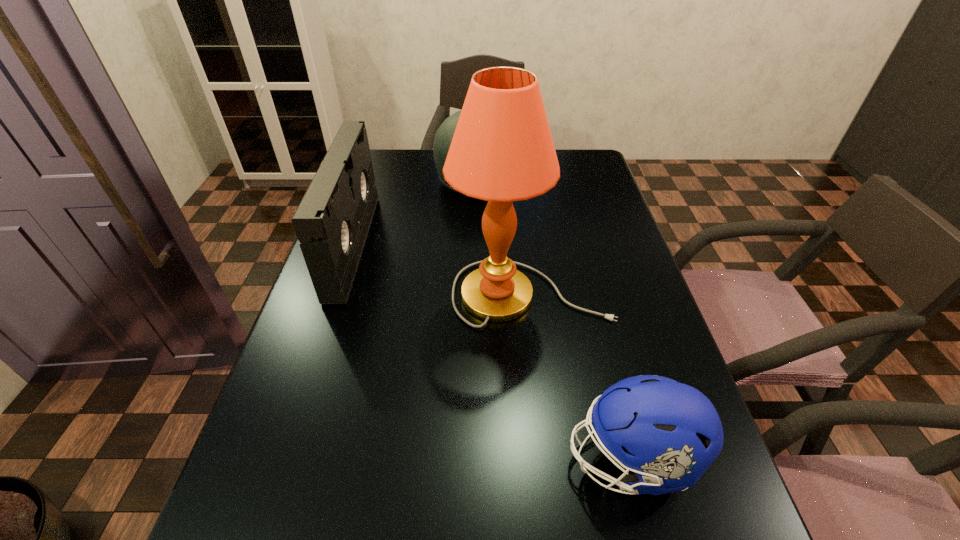
Identify the location of free space between the nearest object and the videotape. The height and width of the screenshot is (540, 960). (492, 352).

Locate an element on the screen. This screenshot has height=540, width=960. vacant point located between the leftmost object and the farther football helmet is located at coordinates [413, 214].

Find the location of a particular element. This screenshot has width=960, height=540. vacant space that's between the tallest object and the nearest object is located at coordinates (581, 376).

Locate an element on the screen. This screenshot has width=960, height=540. free space between the shortest object and the lamp is located at coordinates (581, 376).

At what (x,y) coordinates should I click in order to perform the action: click on empty space between the right football helmet and the taller football helmet. Please return your answer as a coordinate pair (x, y). Image resolution: width=960 pixels, height=540 pixels. Looking at the image, I should click on (552, 321).

Identify the location of unoccupied area between the taller football helmet and the nearest object. (552, 321).

Locate an element on the screen. This screenshot has height=540, width=960. vacant space in between the lamp and the videotape is located at coordinates (442, 269).

Identify the location of vacant space in between the lamp and the leftmost object. Image resolution: width=960 pixels, height=540 pixels. (442, 269).

This screenshot has width=960, height=540. In order to click on the third closest object relative to the videotape in this screenshot , I will do `click(668, 433)`.

This screenshot has height=540, width=960. I want to click on object that can be found as the second closest to the taller football helmet, so click(502, 150).